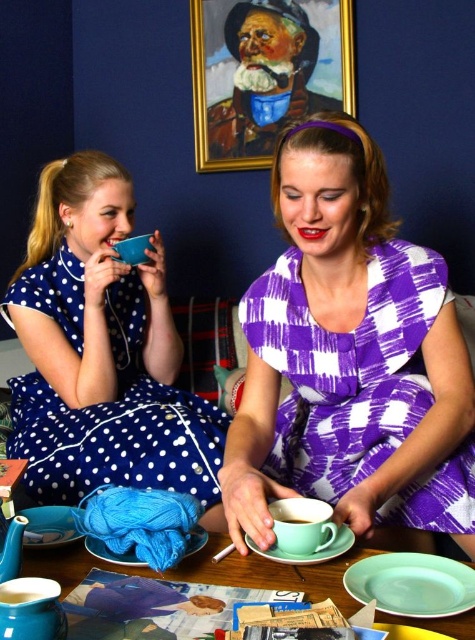
Can you confirm if blue fabric plate at lower left is smaller than matte green saucer at lower center?

Actually, blue fabric plate at lower left might be larger than matte green saucer at lower center.

Which is behind, point (60, 534) or point (323, 545)?

Point (60, 534)

Find the location of `blue fabric plate at lower left`. blue fabric plate at lower left is located at coordinates (48, 525).

In the scene shown: Is matte ceramic teacup at lower center closer to camera compared to matte green saucer at lower center?

That is False.

Describe the element at coordinates (302, 524) in the screenshot. This screenshot has width=475, height=640. I see `matte ceramic teacup at lower center` at that location.

Where is `matte ceramic teacup at lower center`? Image resolution: width=475 pixels, height=640 pixels. matte ceramic teacup at lower center is located at coordinates (302, 524).

Who is positioned more to the right, green matte plate at lower right or blue fabric at lower center?

green matte plate at lower right

Does green matte plate at lower right have a greater height compared to blue fabric at lower center?

No, green matte plate at lower right is not taller than blue fabric at lower center.

Where is `green matte plate at lower right`? The width and height of the screenshot is (475, 640). green matte plate at lower right is located at coordinates (411, 584).